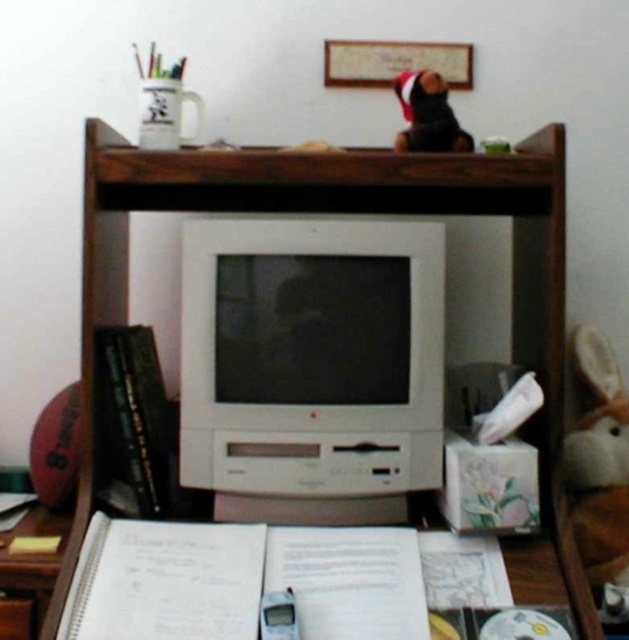
You are organizing your desk and need to move items from the wooden drawer at lower left to the white plastic monitor at center. Which object should you move first to ensure you can access both easily?

You should move items from the wooden drawer at lower left first because the white plastic monitor at center is closer to you, so accessing the drawer first allows easier access to both.

You are organizing a workspace and need to place a new keyboard. The keyboard requires a flat surface that is closer to you. Which object should you choose between the white plastic computer desk at center and the wooden drawer at lower left?

The white plastic computer desk at center is closer to the viewer than the wooden drawer at lower left, so you should place the keyboard on the white plastic computer desk at center.